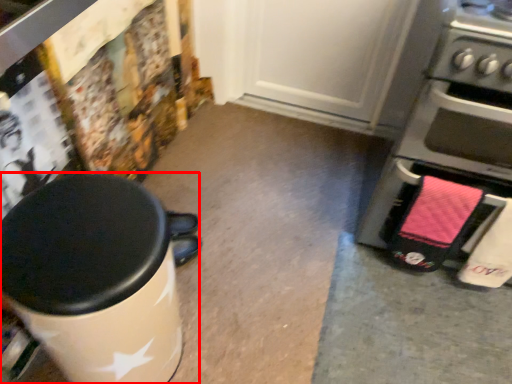
Question: From the image's perspective, what is the correct spatial relationship of waste container (annotated by the red box) in relation to home appliance?

Choices:
 (A) below
 (B) above

Answer: (A)